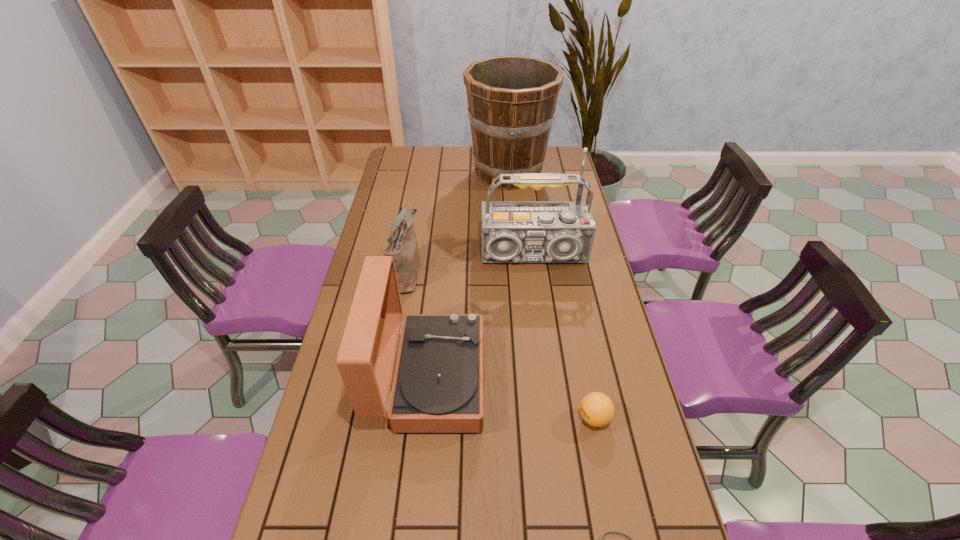
You are a GUI agent. You are given a task and a screenshot of the screen. Output one action in this format:
    pyautogui.click(x=<x>, y=<y>)
    Task: Click on the vacant space at the far edge
    The image size is (960, 540).
    Given the screenshot: What is the action you would take?
    pyautogui.click(x=454, y=147)

The image size is (960, 540). I want to click on free space at the left edge of the desktop, so click(x=354, y=476).

This screenshot has height=540, width=960. I want to click on free space at the right edge, so click(615, 347).

Find the location of a particular element. vacant area at the far right corner of the desktop is located at coordinates (544, 161).

Where is `vacant space in between the third shortest object and the radio receiver`? The width and height of the screenshot is (960, 540). vacant space in between the third shortest object and the radio receiver is located at coordinates (471, 265).

The height and width of the screenshot is (540, 960). Identify the location of empty location between the radio receiver and the shoulder bag. coord(471,265).

The width and height of the screenshot is (960, 540). I want to click on free spot between the ping-pong ball and the phonograph record, so click(x=512, y=399).

Locate an element on the screen. This screenshot has width=960, height=540. free space that is in between the third shortest object and the ping-pong ball is located at coordinates (501, 345).

Locate which object ranks third in proximity to the bucket. Please provide its 2D coordinates. Your answer should be formatted as a tuple, i.e. [(x, y)], where the tuple contains the x and y coordinates of a point satisfying the conditions above.

[(438, 386)]

Where is `the fourth closest object to the third shortest object`? This screenshot has height=540, width=960. the fourth closest object to the third shortest object is located at coordinates (597, 409).